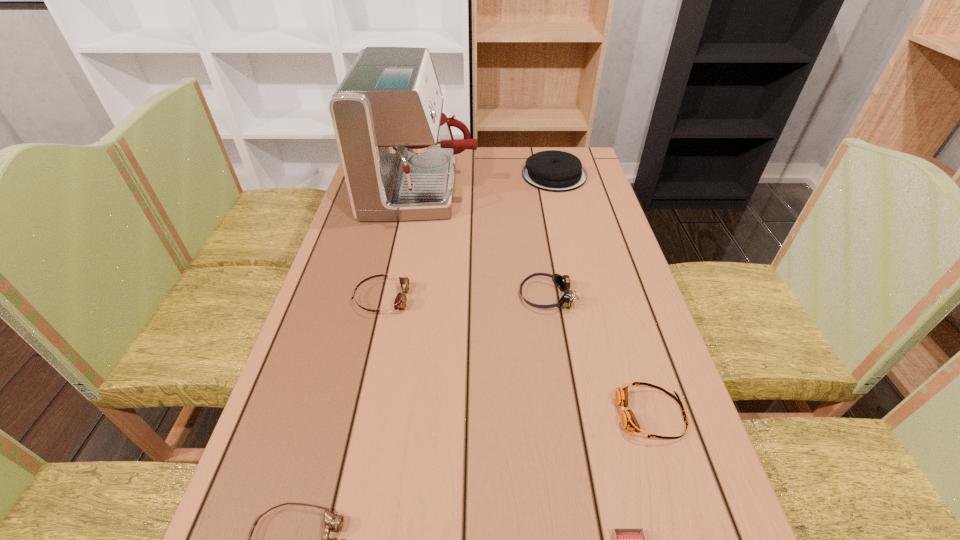
Where is `coffee maker`? The height and width of the screenshot is (540, 960). coffee maker is located at coordinates (397, 150).

The width and height of the screenshot is (960, 540). I want to click on pancake, so click(555, 171).

Locate an element on the screen. The width and height of the screenshot is (960, 540). the third goggles from left to right is located at coordinates (562, 282).

The image size is (960, 540). I want to click on the fifth shortest object, so click(562, 282).

Image resolution: width=960 pixels, height=540 pixels. I want to click on the second nearest goggles, so click(628, 421).

Locate an element on the screen. the rightmost goggles is located at coordinates (628, 421).

Identify the location of free space located 0.250m on the front of the coffee maker near the spout. (554, 190).

Where is `vacant space situated 0.200m on the front of the pancake`? vacant space situated 0.200m on the front of the pancake is located at coordinates (567, 230).

Identify the location of vacant position located 0.290m through the lenses of the second goggles from right to left. [x=402, y=296].

This screenshot has height=540, width=960. Identify the location of free region located 0.170m through the lenses of the second goggles from right to left. (450, 296).